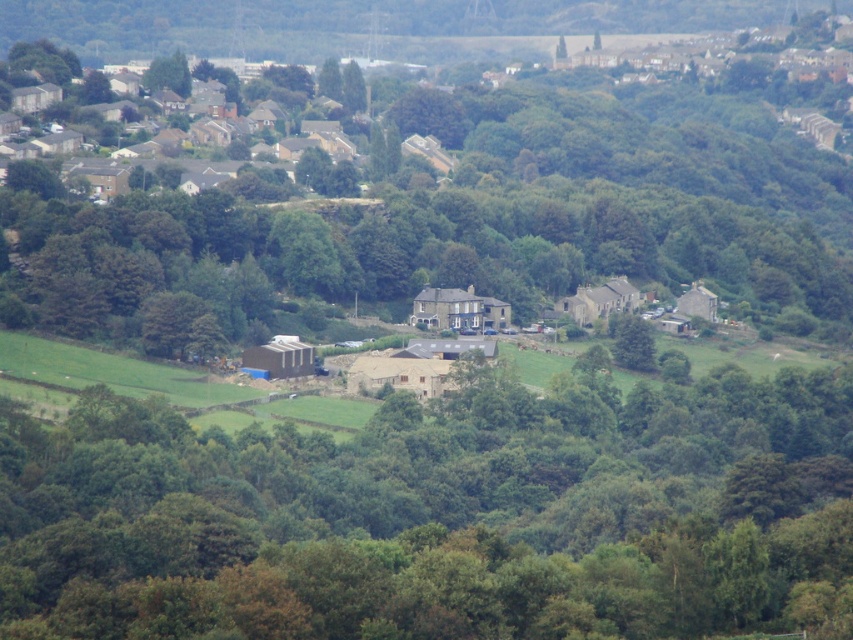
Looking at the rural landscape, you notice a brown wooden barn at center and green leafy trees at center. Which object is positioned to the right side?

The brown wooden barn at center is positioned to the right of the green leafy trees at center.

You are a farmer planning to plant new crops between the brown wooden barn at center and the green leafy trees at center. Given their widths, which object should you place closer to the edge of the field to ensure enough space for the crops?

The brown wooden barn at center has a smaller width than the green leafy trees at center, so you should place the brown wooden barn at center closer to the edge to leave more space for the crops.